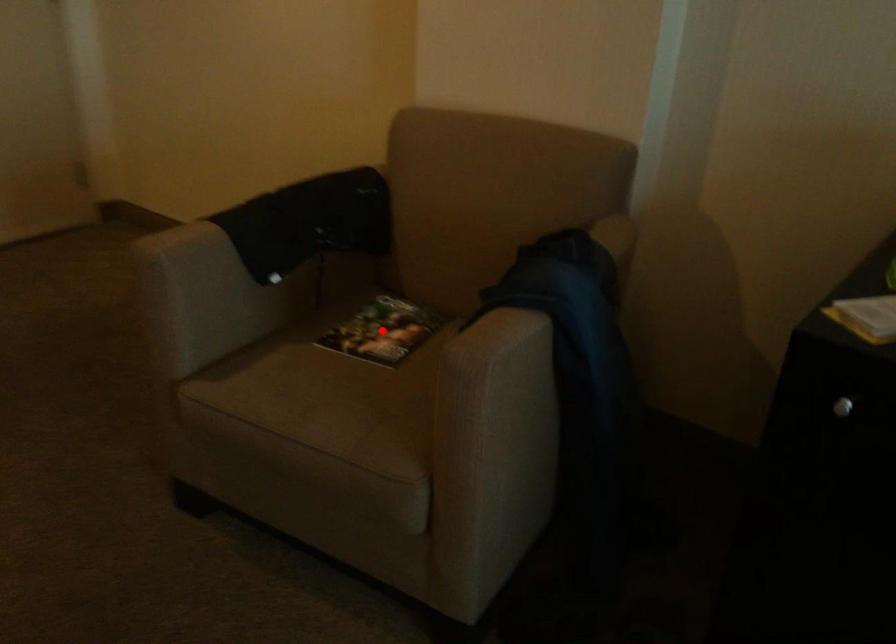
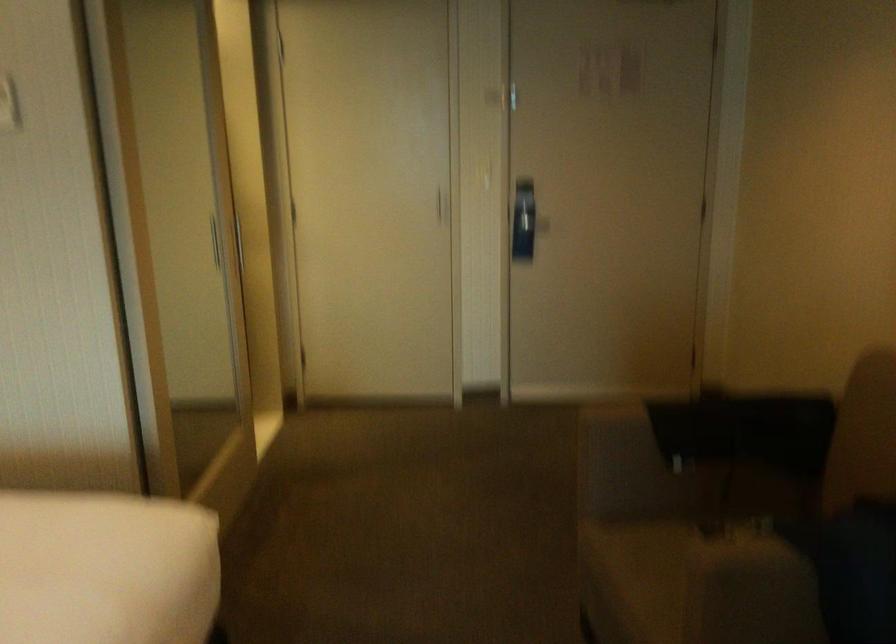
Question: I am providing you with two images of the same scene from different viewpoints. A red point is marked on the first image. At the location where the point appears in image 1, is it still visible in image 2?

Choices:
 (A) Yes
 (B) No

Answer: (B)